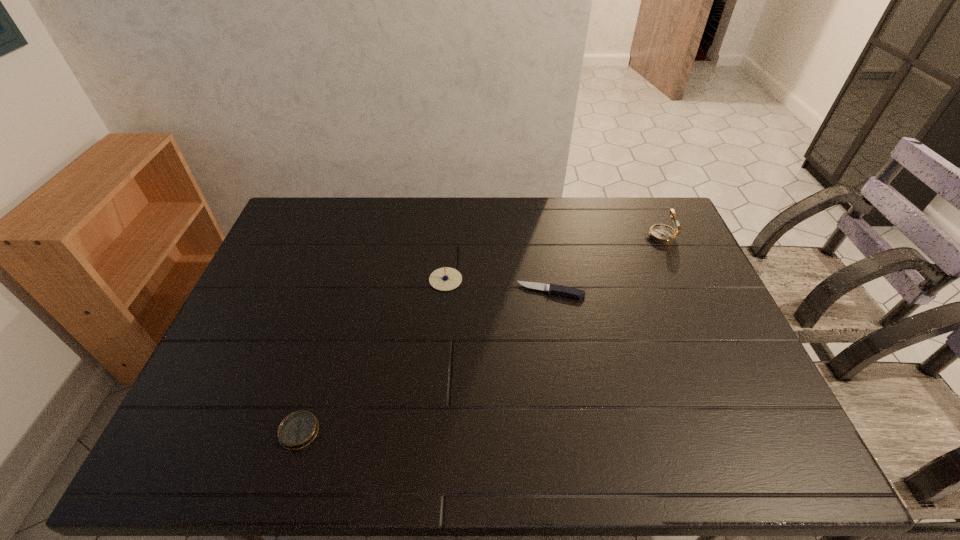
At what (x,y) coordinates should I click in order to perform the action: click on vacant area located 0.110m on the right of the second compass from left to right. Please return your answer as a coordinate pair (x, y). The image size is (960, 540). Looking at the image, I should click on (497, 280).

Find the location of a particular element. The image size is (960, 540). blank space located on the right of the third object from left to right is located at coordinates (643, 292).

Where is `vacant space located on the back of the shortest compass`? Image resolution: width=960 pixels, height=540 pixels. vacant space located on the back of the shortest compass is located at coordinates (325, 345).

Find the location of a particular element. The image size is (960, 540). object situated at the far edge is located at coordinates (663, 234).

Image resolution: width=960 pixels, height=540 pixels. Find the location of `object present at the near edge`. object present at the near edge is located at coordinates (297, 430).

You are a GUI agent. You are given a task and a screenshot of the screen. Output one action in this format:
    pyautogui.click(x=<x>, y=<y>)
    Task: Click on the object located in the right edge section of the desktop
    Image resolution: width=960 pixels, height=540 pixels.
    Given the screenshot: What is the action you would take?
    pyautogui.click(x=663, y=234)

Identify the location of object that is at the far right corner. (663, 234).

At what (x,y) coordinates should I click in order to perform the action: click on vacant space at the far edge of the desktop. Please return your answer as a coordinate pair (x, y). Looking at the image, I should click on (616, 217).

I want to click on free space at the near edge, so [x=504, y=436].

This screenshot has height=540, width=960. In the image, there is a desktop. What are the coordinates of `free space at the right edge` in the screenshot? It's located at (651, 258).